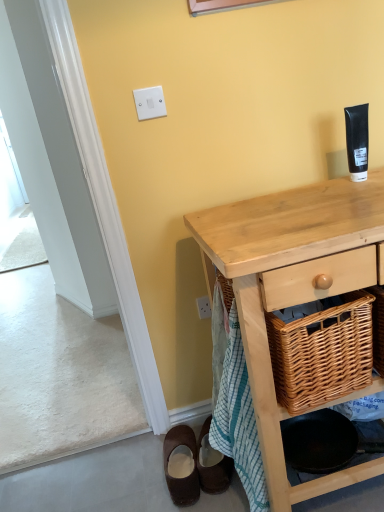
Locate an element on the screen. The image size is (384, 512). free space above natural wood desk at center (from a real-world perspective) is located at coordinates (316, 211).